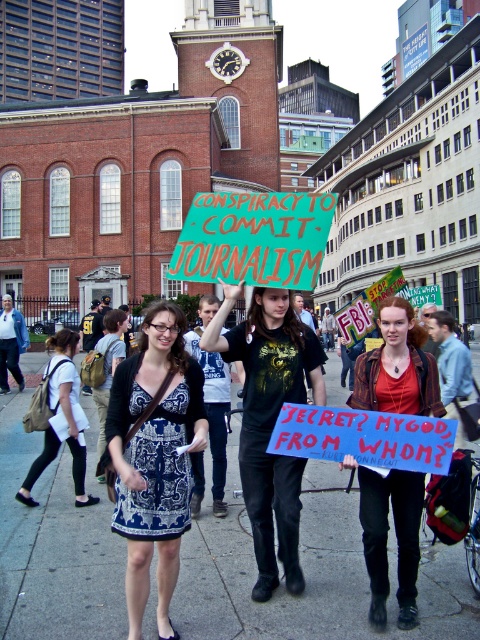
Question: Is gray concrete pavement at center below green fabric sign at center?

Choices:
 (A) yes
 (B) no

Answer: (A)

Question: Which of these objects is positioned closest to the matte red shirt at center?

Choices:
 (A) matte black dress at center
 (B) blue printed dress at center
 (C) black t-shirt at center
 (D) green fabric sign at center

Answer: (B)

Question: Which object is closer to the camera taking this photo?

Choices:
 (A) black t-shirt at center
 (B) matte black dress at center

Answer: (A)

Question: Which point is closer to the camera taking this photo?

Choices:
 (A) 317,232
 (B) 243,349
 (C) 319,605
 (D) 379,513

Answer: (C)

Question: Where is gray concrete pavement at center located in relation to matte red shirt at center in the image?

Choices:
 (A) left
 (B) right

Answer: (A)

Question: Does gray concrete pavement at center come in front of matte black dress at center?

Choices:
 (A) no
 (B) yes

Answer: (B)